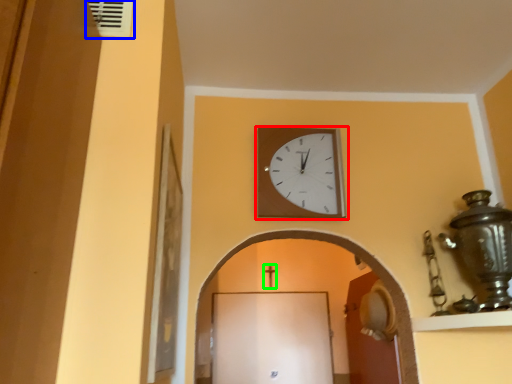
Question: Which is farther away from wall clock (highlighted by a red box)? air conditioning (highlighted by a blue box) or crucifix (highlighted by a green box)?

Choices:
 (A) air conditioning
 (B) crucifix

Answer: (B)